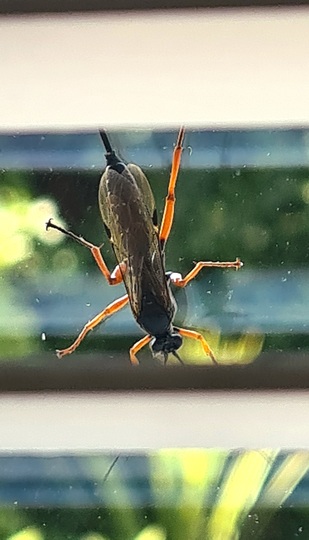
Where is `window`? window is located at coordinates (275, 514).